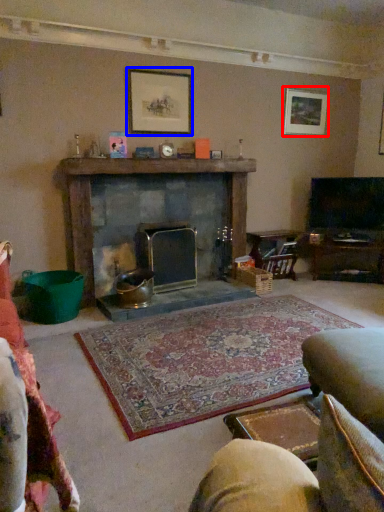
Question: Among these objects, which one is farthest to the camera, picture frame (highlighted by a red box) or picture frame (highlighted by a blue box)?

Choices:
 (A) picture frame
 (B) picture frame

Answer: (A)